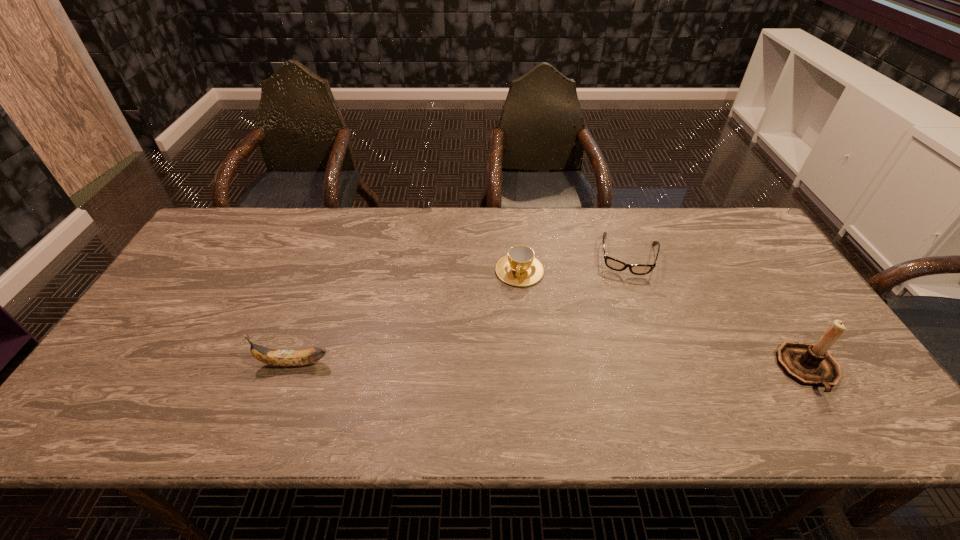
The width and height of the screenshot is (960, 540). I want to click on free spot that satisfies the following two spatial constraints: 1. on the front side of the tallest object; 2. on the right side of the spectacles, so click(669, 370).